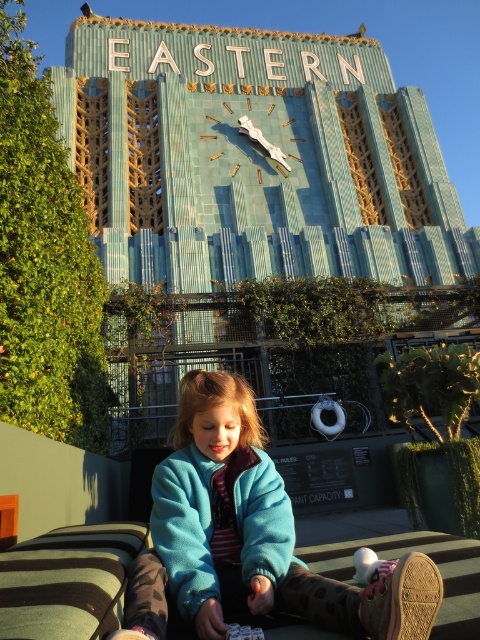
Question: Is blue fleece jacket at center smaller than silver metallic clock at upper center?

Choices:
 (A) no
 (B) yes

Answer: (A)

Question: Does blue fleece jacket at center have a greater width compared to silver metallic clock at upper center?

Choices:
 (A) no
 (B) yes

Answer: (A)

Question: Which of the following is the farthest from the observer?

Choices:
 (A) blue fleece jacket at center
 (B) silver metallic clock at upper center

Answer: (B)

Question: Can you confirm if blue fleece jacket at center is wider than silver metallic clock at upper center?

Choices:
 (A) no
 (B) yes

Answer: (A)